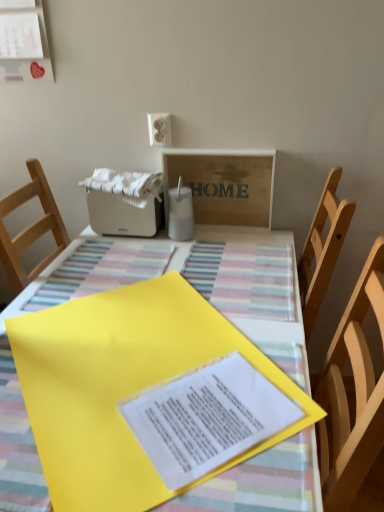
Where is `free spot in front of white plastic toaster at upper center`? free spot in front of white plastic toaster at upper center is located at coordinates (114, 257).